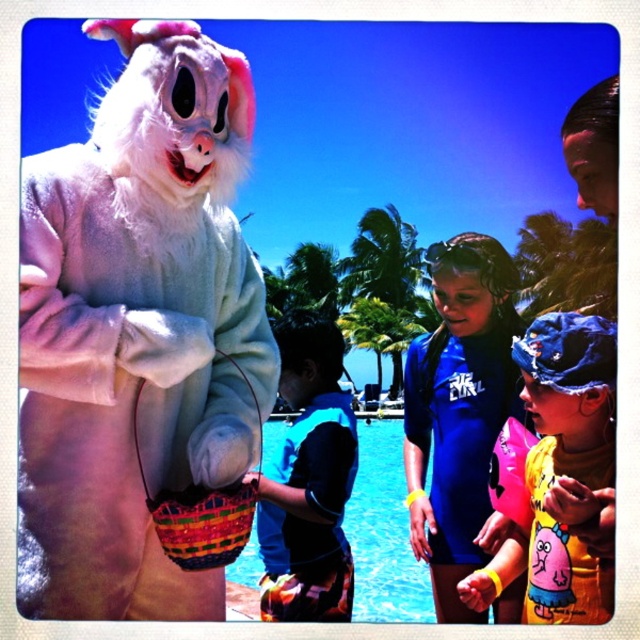
Question: Is fluffy white bunny at upper left behind bright multicolored woven basket at lower left?

Choices:
 (A) no
 (B) yes

Answer: (A)

Question: Which point is farther to the camera?

Choices:
 (A) blue glossy pool at center
 (B) bright multicolored woven basket at lower left

Answer: (A)

Question: Can you confirm if yellow rubber arm band at lower right is positioned to the right of blue glossy pool at center?

Choices:
 (A) yes
 (B) no

Answer: (A)

Question: Which is farther from the yellow rubber arm band at lower right?

Choices:
 (A) fluffy white bunny at upper left
 (B) blue glossy pool at center

Answer: (B)

Question: Which point is farther from the camera taking this photo?

Choices:
 (A) (529, 452)
 (B) (397, 445)
 (C) (122, 545)
 (D) (179, 497)

Answer: (B)

Question: Is yellow rubber arm band at lower right positioned before blue glossy pool at center?

Choices:
 (A) yes
 (B) no

Answer: (A)